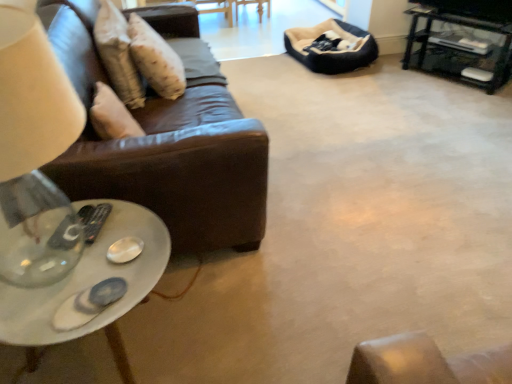
Where is `vacant region to the left of black plastic remote at lower left`? The height and width of the screenshot is (384, 512). vacant region to the left of black plastic remote at lower left is located at coordinates (61, 223).